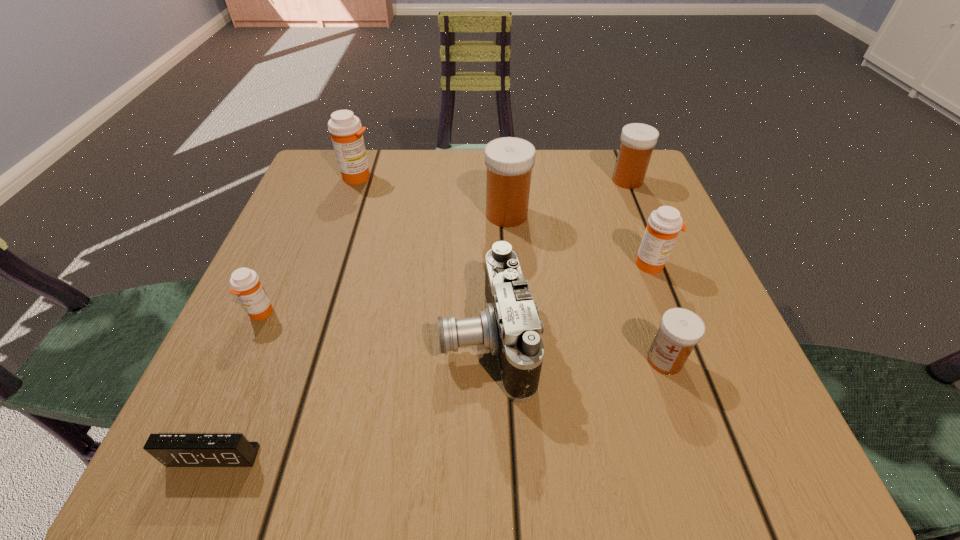
Locate an element on the screen. This screenshot has height=540, width=960. the nearest white medicine is located at coordinates (680, 330).

This screenshot has width=960, height=540. I want to click on the nearest medicine, so click(x=680, y=330).

Locate an element on the screen. The height and width of the screenshot is (540, 960). alarm clock is located at coordinates (172, 450).

You are a GUI agent. You are given a task and a screenshot of the screen. Output one action in this format:
    pyautogui.click(x=<x>, y=<y>)
    Task: Click on the nearest object
    The width and height of the screenshot is (960, 540).
    Given the screenshot: What is the action you would take?
    pyautogui.click(x=172, y=450)

This screenshot has width=960, height=540. Find the location of `vacant space situated on the right of the farthest orange medicine`. vacant space situated on the right of the farthest orange medicine is located at coordinates pyautogui.click(x=454, y=177).

Where is `vacant region located 0.150m on the left of the second farthest white medicine`? The image size is (960, 540). vacant region located 0.150m on the left of the second farthest white medicine is located at coordinates (412, 214).

The height and width of the screenshot is (540, 960). Identify the location of vacant space positioned 0.060m on the back of the farthest white medicine. (618, 158).

The image size is (960, 540). I want to click on free space located 0.360m on the back of the rightmost orange medicine, so click(609, 154).

Image resolution: width=960 pixels, height=540 pixels. Identify the location of vacant space positioned 0.210m at the lens of the camera. (306, 339).

What are the coordinates of `free point located 0.170m at the lens of the camera` in the screenshot? It's located at (332, 339).